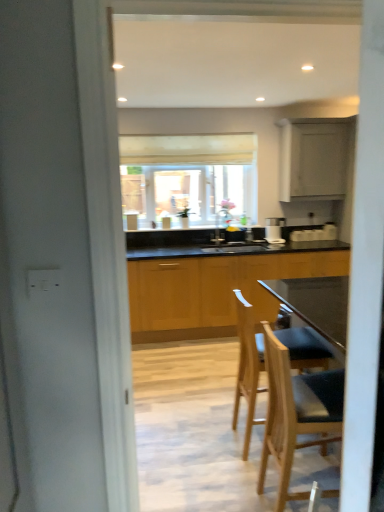
In order to face wooden bar stool at center, positioned as the second chair in back-to-front order, should I rotate leftwards or rightwards?

It's best to rotate right around 16.149 degrees.

Measure the distance between wooden bar stool at center, positioned as the second chair in back-to-front order, and camera.

A distance of 5.68 feet exists between wooden bar stool at center, positioned as the second chair in back-to-front order, and camera.

Image resolution: width=384 pixels, height=512 pixels. I want to click on light wood bar stool at center, which is counted as the second chair, starting from the front, so click(248, 366).

What do you see at coordinates (314, 158) in the screenshot? I see `matte wood cabinet at upper right, which is the 1th cabinetry in top-to-bottom order` at bounding box center [314, 158].

Describe the element at coordinates (214, 290) in the screenshot. The height and width of the screenshot is (512, 384). I see `wooden cabinets at center, which is the 2th cabinetry in top-to-bottom order` at that location.

The width and height of the screenshot is (384, 512). In order to click on wooden cabinets at center, arranged as the first cabinetry when ordered from the bottom in this screenshot , I will do `click(214, 290)`.

Locate an element on the screen. The height and width of the screenshot is (512, 384). matte white window at center is located at coordinates (189, 178).

This screenshot has height=512, width=384. Describe the element at coordinates (274, 230) in the screenshot. I see `satin silver coffee machine at center` at that location.

Locate an element on the screen. The width and height of the screenshot is (384, 512). wooden bar stool at center, the 1th chair in the front-to-back sequence is located at coordinates pyautogui.click(x=297, y=413).

Starting from the matte white window at center, which cabinetry is the 2nd one in front? Please provide its 2D coordinates.

[(214, 290)]

Does wooden cabinets at center, arranged as the first cabinetry when ordered from the bottom, have a greater height compared to matte white window at center?

Indeed, wooden cabinets at center, arranged as the first cabinetry when ordered from the bottom, has a greater height compared to matte white window at center.

From a real-world perspective, is wooden cabinets at center, which is the 2th cabinetry in top-to-bottom order, above or below matte white window at center?

wooden cabinets at center, which is the 2th cabinetry in top-to-bottom order, is situated lower than matte white window at center in the real world.

From the image's perspective, is wooden cabinets at center, which is the 2th cabinetry in top-to-bottom order, over matte white window at center?

Incorrect, from the image's perspective, wooden cabinets at center, which is the 2th cabinetry in top-to-bottom order, is lower than matte white window at center.

Which of these two, matte wood cabinet at upper right, which is the 1th cabinetry in top-to-bottom order, or light wood bar stool at center, which is counted as the second chair, starting from the front, is thinner?

With smaller width is matte wood cabinet at upper right, which is the 1th cabinetry in top-to-bottom order.

Which object is closer to the camera, matte wood cabinet at upper right, placed as the 2th cabinetry when sorted from bottom to top, or light wood bar stool at center, which is the first chair in back-to-front order?

Positioned in front is light wood bar stool at center, which is the first chair in back-to-front order.

Which of these two, matte wood cabinet at upper right, placed as the 2th cabinetry when sorted from bottom to top, or light wood bar stool at center, which is the first chair in back-to-front order, is bigger?

matte wood cabinet at upper right, placed as the 2th cabinetry when sorted from bottom to top, is bigger.

Consider the image. Is light wood bar stool at center, which is the first chair in back-to-front order, surrounded by matte wood cabinet at upper right, which is the 1th cabinetry in top-to-bottom order?

No, light wood bar stool at center, which is the first chair in back-to-front order, is not a part of matte wood cabinet at upper right, which is the 1th cabinetry in top-to-bottom order.

Choose the correct answer: Is matte white window at center inside wooden bar stool at center, positioned as the second chair in back-to-front order, or outside it?

matte white window at center lies outside wooden bar stool at center, positioned as the second chair in back-to-front order.

Can you see matte white window at center touching wooden bar stool at center, positioned as the second chair in back-to-front order?

No, matte white window at center is not beside wooden bar stool at center, positioned as the second chair in back-to-front order.

Does point (158, 199) lie in front of point (282, 470)?

That is False.

Can you confirm if matte wood cabinet at upper right, which is the 1th cabinetry in top-to-bottom order, is positioned to the right of matte white window at center?

Yes.

Does matte wood cabinet at upper right, which is the 1th cabinetry in top-to-bottom order, lie behind matte white window at center?

No, matte wood cabinet at upper right, which is the 1th cabinetry in top-to-bottom order, is closer to the camera.

Is matte wood cabinet at upper right, placed as the 2th cabinetry when sorted from bottom to top, placed right next to matte white window at center?

No, matte wood cabinet at upper right, placed as the 2th cabinetry when sorted from bottom to top, is not with matte white window at center.

Is matte wood cabinet at upper right, which is the 1th cabinetry in top-to-bottom order, bigger than matte white window at center?

No.

Is light wood bar stool at center, which is the first chair in back-to-front order, not within wooden bar stool at center, the 1th chair in the front-to-back sequence?

Yes.

Considering the points (290, 347) and (272, 453), which point is behind, point (290, 347) or point (272, 453)?

Point (290, 347)

Considering the relative sizes of light wood bar stool at center, which is the first chair in back-to-front order, and wooden bar stool at center, positioned as the second chair in back-to-front order, in the image provided, is light wood bar stool at center, which is the first chair in back-to-front order, wider than wooden bar stool at center, positioned as the second chair in back-to-front order,?

Indeed, light wood bar stool at center, which is the first chair in back-to-front order, has a greater width compared to wooden bar stool at center, positioned as the second chair in back-to-front order.

From the image's perspective, would you say wooden bar stool at center, the 1th chair in the front-to-back sequence, is positioned over satin silver coffee machine at center?

No, from the image's perspective, wooden bar stool at center, the 1th chair in the front-to-back sequence, is not on top of satin silver coffee machine at center.

How many degrees apart are the facing directions of wooden bar stool at center, positioned as the second chair in back-to-front order, and satin silver coffee machine at center?

There is a 85.4-degree angle between the facing directions of wooden bar stool at center, positioned as the second chair in back-to-front order, and satin silver coffee machine at center.

Which object is further away from the camera taking this photo, wooden bar stool at center, the 1th chair in the front-to-back sequence, or satin silver coffee machine at center?

satin silver coffee machine at center is behind.

Can you confirm if wooden bar stool at center, the 1th chair in the front-to-back sequence, is positioned to the right of satin silver coffee machine at center?

In fact, wooden bar stool at center, the 1th chair in the front-to-back sequence, is to the left of satin silver coffee machine at center.

How distant is wooden bar stool at center, the 1th chair in the front-to-back sequence, from light wood bar stool at center, which is the first chair in back-to-front order?

29.58 centimeters.

Considering the sizes of objects wooden bar stool at center, positioned as the second chair in back-to-front order, and light wood bar stool at center, which is counted as the second chair, starting from the front, in the image provided, who is wider, wooden bar stool at center, positioned as the second chair in back-to-front order, or light wood bar stool at center, which is counted as the second chair, starting from the front,?

light wood bar stool at center, which is counted as the second chair, starting from the front, is wider.

Looking at this image, from the image's perspective, would you say wooden bar stool at center, the 1th chair in the front-to-back sequence, is shown under light wood bar stool at center, which is counted as the second chair, starting from the front?

Correct, wooden bar stool at center, the 1th chair in the front-to-back sequence, appears lower than light wood bar stool at center, which is counted as the second chair, starting from the front, in the image.

Between wooden bar stool at center, the 1th chair in the front-to-back sequence, and light wood bar stool at center, which is the first chair in back-to-front order, which one appears on the right side from the viewer's perspective?

From the viewer's perspective, wooden bar stool at center, the 1th chair in the front-to-back sequence, appears more on the right side.

Image resolution: width=384 pixels, height=512 pixels. In order to click on window that appears behind the wooden cabinets at center, which is the 2th cabinetry in top-to-bottom order in this screenshot , I will do `click(189, 178)`.

There is a matte wood cabinet at upper right, placed as the 2th cabinetry when sorted from bottom to top. Identify the location of the 2nd chair below it (from a real-world perspective). This screenshot has width=384, height=512. (248, 366).

Estimate the real-world distances between objects in this image. Which object is further from matte white window at center, wooden cabinets at center, arranged as the first cabinetry when ordered from the bottom, or wooden bar stool at center, positioned as the second chair in back-to-front order?

The object further to matte white window at center is wooden bar stool at center, positioned as the second chair in back-to-front order.

Considering their positions, is satin silver coffee machine at center positioned further to wooden bar stool at center, the 1th chair in the front-to-back sequence, than matte white window at center?

matte white window at center is further to wooden bar stool at center, the 1th chair in the front-to-back sequence.

When comparing their distances from wooden bar stool at center, the 1th chair in the front-to-back sequence, does matte wood cabinet at upper right, which is the 1th cabinetry in top-to-bottom order, or satin silver coffee machine at center seem further?

The object further to wooden bar stool at center, the 1th chair in the front-to-back sequence, is matte wood cabinet at upper right, which is the 1th cabinetry in top-to-bottom order.

When comparing their distances from matte white window at center, does light wood bar stool at center, which is the first chair in back-to-front order, or matte wood cabinet at upper right, which is the 1th cabinetry in top-to-bottom order, seem further?

Among the two, light wood bar stool at center, which is the first chair in back-to-front order, is located further to matte white window at center.

Looking at the image, which one is located further to satin silver coffee machine at center, matte wood cabinet at upper right, placed as the 2th cabinetry when sorted from bottom to top, or wooden bar stool at center, positioned as the second chair in back-to-front order?

wooden bar stool at center, positioned as the second chair in back-to-front order, is further to satin silver coffee machine at center.

Based on their spatial positions, is matte white window at center or wooden bar stool at center, the 1th chair in the front-to-back sequence, further from satin silver coffee machine at center?

wooden bar stool at center, the 1th chair in the front-to-back sequence, lies further to satin silver coffee machine at center than the other object.

Looking at the image, which one is located closer to wooden cabinets at center, which is the 2th cabinetry in top-to-bottom order, matte white window at center or light wood bar stool at center, which is counted as the second chair, starting from the front?

Among the two, matte white window at center is located nearer to wooden cabinets at center, which is the 2th cabinetry in top-to-bottom order.

From the image, which object appears to be farther from satin silver coffee machine at center, light wood bar stool at center, which is the first chair in back-to-front order, or matte white window at center?

light wood bar stool at center, which is the first chair in back-to-front order, is positioned further to the anchor satin silver coffee machine at center.

Locate an element on the screen. This screenshot has width=384, height=512. window located between wooden bar stool at center, the 1th chair in the front-to-back sequence, and satin silver coffee machine at center in the depth direction is located at coordinates (189, 178).

Identify the location of window between matte wood cabinet at upper right, placed as the 2th cabinetry when sorted from bottom to top, and wooden cabinets at center, arranged as the first cabinetry when ordered from the bottom, in the vertical direction. Image resolution: width=384 pixels, height=512 pixels. (189, 178).

In order to click on coffee machine between matte white window at center and wooden cabinets at center, arranged as the first cabinetry when ordered from the bottom, vertically in this screenshot , I will do click(274, 230).

This screenshot has height=512, width=384. What are the coordinates of `cabinetry between light wood bar stool at center, which is the first chair in back-to-front order, and matte wood cabinet at upper right, placed as the 2th cabinetry when sorted from bottom to top, in the front-back direction` in the screenshot? It's located at (214, 290).